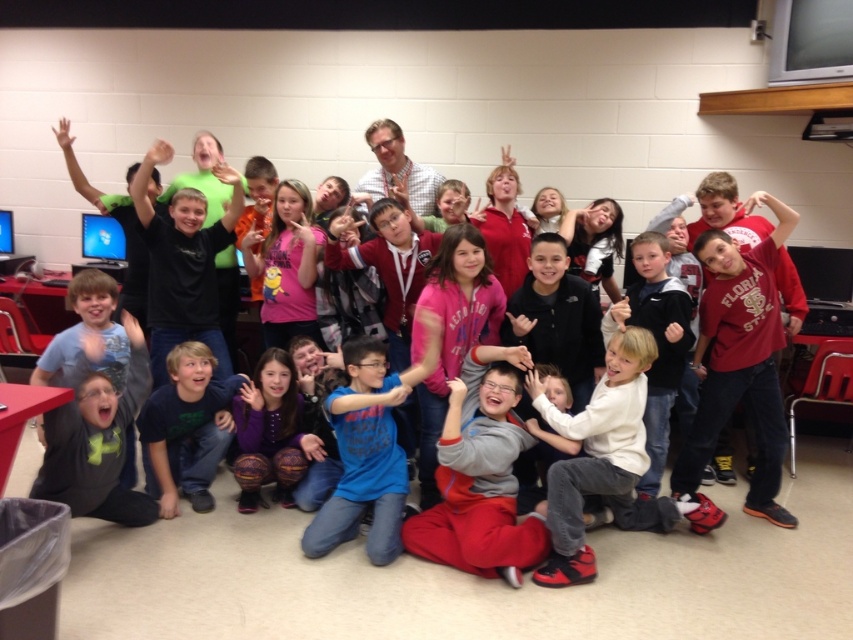
Who is higher up, matte gray hoodie at center or white cotton shirt at center?

matte gray hoodie at center

Is matte gray hoodie at center to the left of white cotton shirt at center from the viewer's perspective?

Yes, matte gray hoodie at center is to the left of white cotton shirt at center.

Identify the location of matte gray hoodie at center. (602, 445).

Where is `matte gray hoodie at center`? matte gray hoodie at center is located at coordinates (602, 445).

Which of these two, dark blue cotton shirt at lower left or purple fuzzy socks at lower center, stands taller?

Standing taller between the two is dark blue cotton shirt at lower left.

Who is more forward, (178, 392) or (309, 456)?

Positioned in front is point (178, 392).

What do you see at coordinates (186, 428) in the screenshot? The image size is (853, 640). I see `dark blue cotton shirt at lower left` at bounding box center [186, 428].

The image size is (853, 640). Find the location of `dark blue cotton shirt at lower left`. dark blue cotton shirt at lower left is located at coordinates (186, 428).

Can you confirm if white cotton shirt at center is shorter than purple fuzzy socks at lower center?

Incorrect, white cotton shirt at center's height does not fall short of purple fuzzy socks at lower center's.

Does white cotton shirt at center have a smaller size compared to purple fuzzy socks at lower center?

Actually, white cotton shirt at center might be larger than purple fuzzy socks at lower center.

Which is behind, point (543, 406) or point (254, 468)?

Positioned behind is point (254, 468).

At what (x,y) coordinates should I click in order to perform the action: click on white cotton shirt at center. Please return your answer as a coordinate pair (x, y). The image size is (853, 640). Looking at the image, I should click on (595, 452).